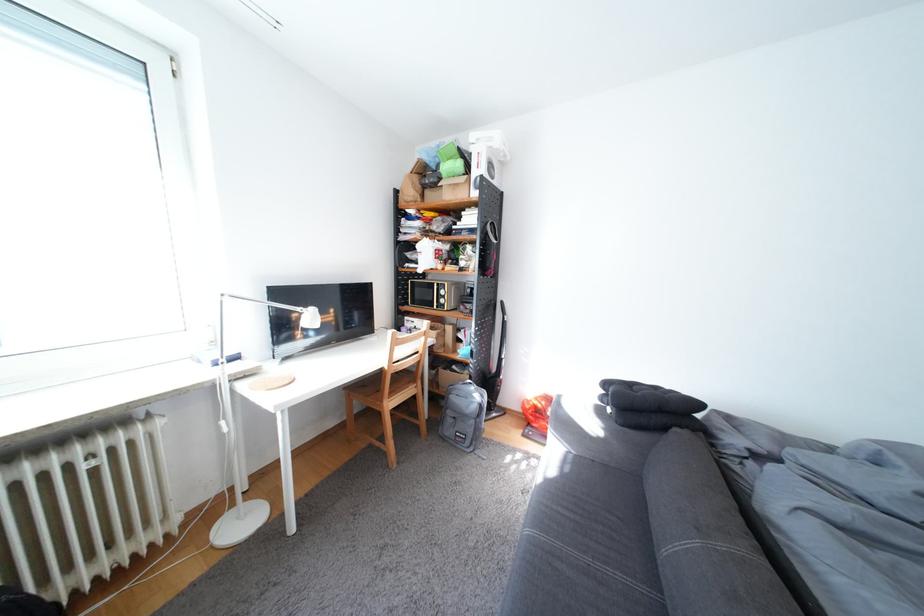
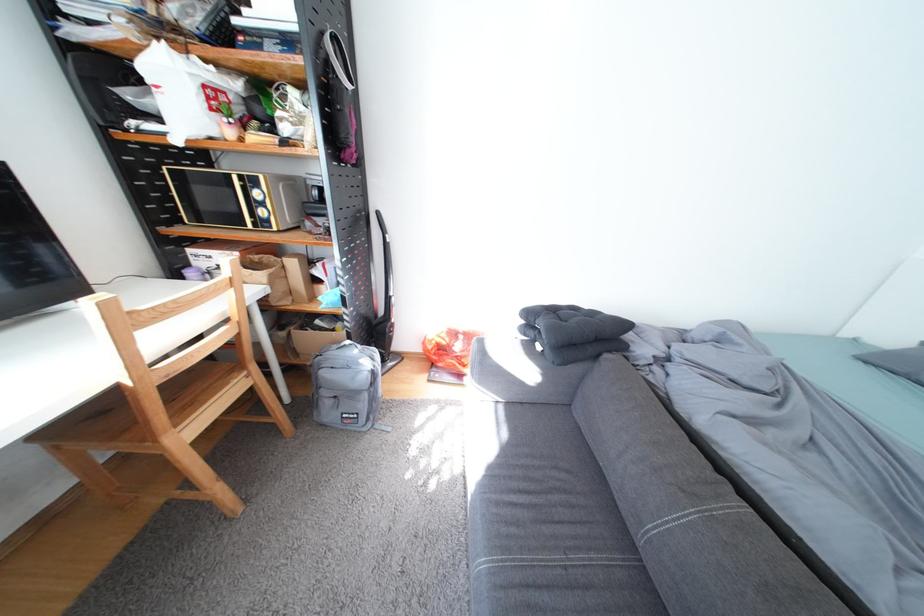
In the second image, find the point that corresponds to the point at 443,300 in the first image.

(246, 209)